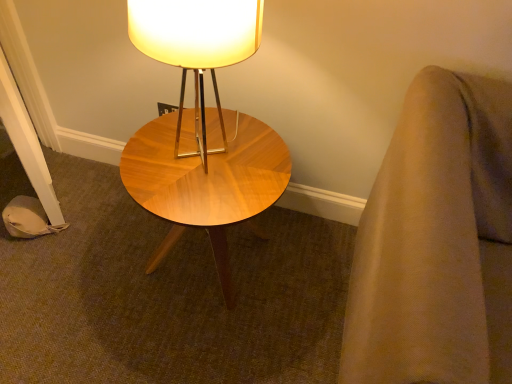
Where is `woodenwoodencoffee table at center`? Image resolution: width=512 pixels, height=384 pixels. woodenwoodencoffee table at center is located at coordinates (206, 181).

Describe the element at coordinates (206, 181) in the screenshot. The image size is (512, 384). I see `woodenwoodencoffee table at center` at that location.

Where is `wooden lampshade at center`? wooden lampshade at center is located at coordinates (197, 47).

Measure the distance between point [208,7] and camera.

The distance of point [208,7] from camera is 31.89 inches.

Describe the element at coordinates (197, 47) in the screenshot. The height and width of the screenshot is (384, 512). I see `wooden lampshade at center` at that location.

Where is `woodenwoodencoffee table at center`? The image size is (512, 384). woodenwoodencoffee table at center is located at coordinates (206, 181).

Visually, is wooden lampshade at center positioned to the left or to the right of woodenwoodencoffee table at center?

From the image, it's evident that wooden lampshade at center is to the right of woodenwoodencoffee table at center.

Does wooden lampshade at center lie in front of woodenwoodencoffee table at center?

Yes, wooden lampshade at center is in front of woodenwoodencoffee table at center.

Which point is more distant from viewer, [130,36] or [247,179]?

The point [247,179] is behind.

From the image's perspective, is wooden lampshade at center above or below woodenwoodencoffee table at center?

wooden lampshade at center is situated higher than woodenwoodencoffee table at center in the image.

From a real-world perspective, who is located higher, wooden lampshade at center or woodenwoodencoffee table at center?

wooden lampshade at center, from a real-world perspective.

Consider the image. Which of these two, wooden lampshade at center or woodenwoodencoffee table at center, is thinner?

wooden lampshade at center.

In the scene shown: Considering the relative sizes of wooden lampshade at center and woodenwoodencoffee table at center in the image provided, is wooden lampshade at center taller than woodenwoodencoffee table at center?

Correct, wooden lampshade at center is much taller as woodenwoodencoffee table at center.

Considering the sizes of objects wooden lampshade at center and woodenwoodencoffee table at center in the image provided, who is smaller, wooden lampshade at center or woodenwoodencoffee table at center?

Smaller between the two is wooden lampshade at center.

Can woodenwoodencoffee table at center be found inside wooden lampshade at center?

No.

Is wooden lampshade at center beside woodenwoodencoffee table at center?

No, wooden lampshade at center is not touching woodenwoodencoffee table at center.

Could you tell me if wooden lampshade at center is facing woodenwoodencoffee table at center?

No, wooden lampshade at center is not turned towards woodenwoodencoffee table at center.

Can you tell me how much wooden lampshade at center and woodenwoodencoffee table at center differ in facing direction?

The angle between the facing direction of wooden lampshade at center and the facing direction of woodenwoodencoffee table at center is 0.767 degrees.

How far apart are wooden lampshade at center and woodenwoodencoffee table at center?

A distance of 15.37 inches exists between wooden lampshade at center and woodenwoodencoffee table at center.

Where is `lamp above the woodenwoodencoffee table at center (from the image's perspective)`? This screenshot has width=512, height=384. lamp above the woodenwoodencoffee table at center (from the image's perspective) is located at coordinates (197, 47).

Looking at this image, between woodenwoodencoffee table at center and wooden lampshade at center, which one appears on the left side from the viewer's perspective?

woodenwoodencoffee table at center.

Which object is more forward, woodenwoodencoffee table at center or wooden lampshade at center?

wooden lampshade at center is more forward.

Considering the positions of points (256, 160) and (152, 8), is point (256, 160) farther from camera compared to point (152, 8)?

Yes, point (256, 160) is farther from viewer.

From the image's perspective, is woodenwoodencoffee table at center located above wooden lampshade at center?

No.

From a real-world perspective, is woodenwoodencoffee table at center positioned under wooden lampshade at center based on gravity?

Indeed, from a real-world perspective, woodenwoodencoffee table at center is positioned beneath wooden lampshade at center.

Is woodenwoodencoffee table at center wider or thinner than wooden lampshade at center?

Clearly, woodenwoodencoffee table at center has more width compared to wooden lampshade at center.

Considering the sizes of objects woodenwoodencoffee table at center and wooden lampshade at center in the image provided, who is shorter, woodenwoodencoffee table at center or wooden lampshade at center?

woodenwoodencoffee table at center.

Can you confirm if woodenwoodencoffee table at center is bigger than wooden lampshade at center?

Correct, woodenwoodencoffee table at center is larger in size than wooden lampshade at center.

Does woodenwoodencoffee table at center contain wooden lampshade at center?

No, woodenwoodencoffee table at center does not contain wooden lampshade at center.

In the scene shown: Is woodenwoodencoffee table at center in contact with wooden lampshade at center?

No, woodenwoodencoffee table at center is not with wooden lampshade at center.

Could you tell me if woodenwoodencoffee table at center is turned towards wooden lampshade at center?

No.

From the picture: How different are the orientations of woodenwoodencoffee table at center and wooden lampshade at center in degrees?

There is a 0.767-degree angle between the facing directions of woodenwoodencoffee table at center and wooden lampshade at center.

The width and height of the screenshot is (512, 384). Identify the location of coffee table located behind the wooden lampshade at center. (206, 181).

Identify the location of coffee table that appears behind the wooden lampshade at center. (206, 181).

This screenshot has width=512, height=384. What are the coordinates of `lamp that is above the woodenwoodencoffee table at center (from a real-world perspective)` in the screenshot? It's located at (197, 47).